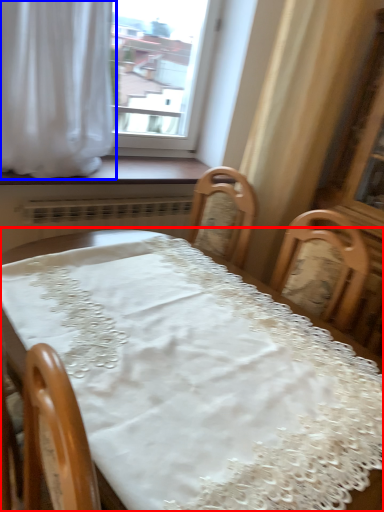
Question: Which object appears farthest to the camera in this image, table (highlighted by a red box) or curtain (highlighted by a blue box)?

Choices:
 (A) table
 (B) curtain

Answer: (B)